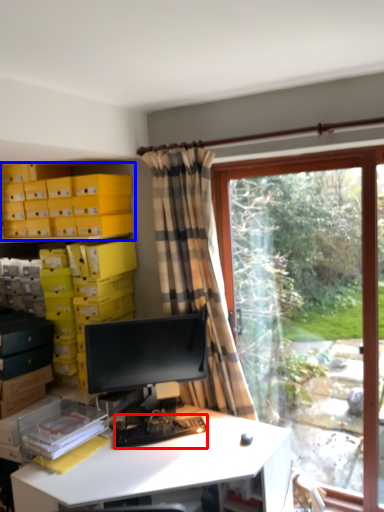
Question: Which object is further to the camera taking this photo, computer keyboard (highlighted by a red box) or shelf (highlighted by a blue box)?

Choices:
 (A) computer keyboard
 (B) shelf

Answer: (B)